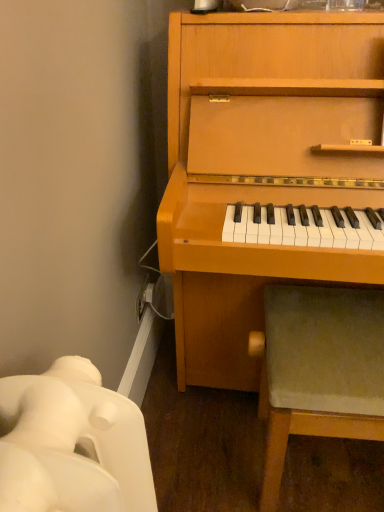
At what (x,y) coordinates should I click in order to perform the action: click on empty space that is ontop of velvet green armchair at lower right (from a real-world perspective). Please return your answer as a coordinate pair (x, y). Image resolution: width=384 pixels, height=512 pixels. Looking at the image, I should click on (336, 326).